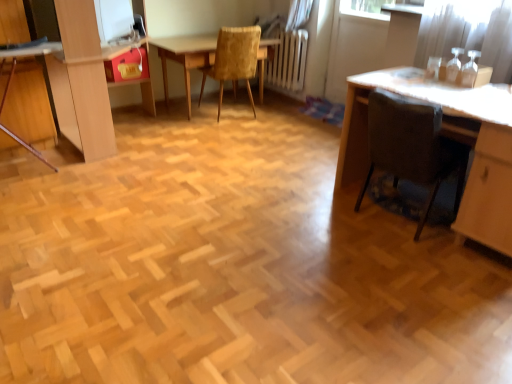
Where is `vacant area located to the right-hand side of velvet yellow chair at center, marked as the 1th chair in a back-to-front arrangement`? vacant area located to the right-hand side of velvet yellow chair at center, marked as the 1th chair in a back-to-front arrangement is located at coordinates (276, 114).